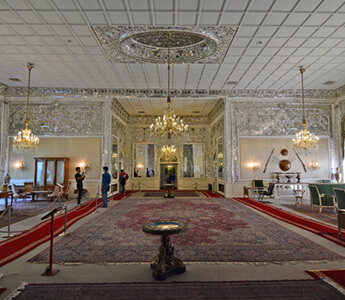
Image resolution: width=345 pixels, height=300 pixels. I want to click on glittery and glassy square piece of the ceiling, so click(219, 35).